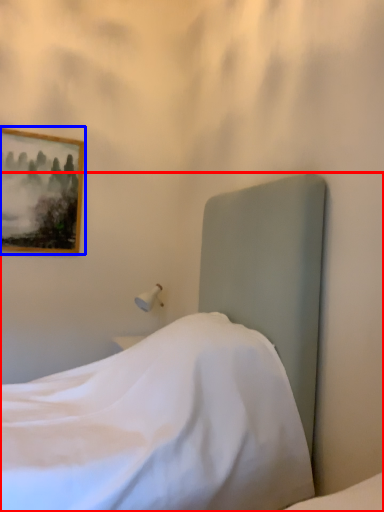
Question: Which of the following is the farthest to the observer, bed (highlighted by a red box) or picture frame (highlighted by a blue box)?

Choices:
 (A) bed
 (B) picture frame

Answer: (B)